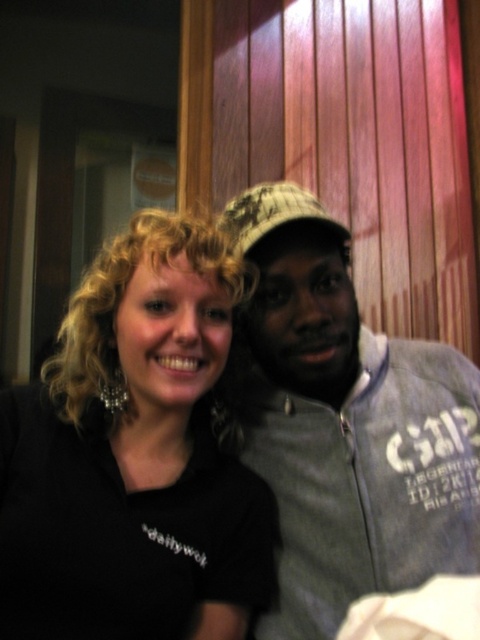
Can you confirm if black matte shirt at center is positioned to the right of gray cotton jacket at right?

Incorrect, black matte shirt at center is not on the right side of gray cotton jacket at right.

Looking at this image, is black matte shirt at center bigger than gray cotton jacket at right?

Incorrect, black matte shirt at center is not larger than gray cotton jacket at right.

Who is more forward, (189,440) or (349,400)?

Point (189,440) is more forward.

Locate an element on the screen. black matte shirt at center is located at coordinates (132, 456).

Can you confirm if black matte shirt at center is positioned to the right of camouflage fabric baseball cap at center?

Incorrect, black matte shirt at center is not on the right side of camouflage fabric baseball cap at center.

Is black matte shirt at center to the left of camouflage fabric baseball cap at center from the viewer's perspective?

Correct, you'll find black matte shirt at center to the left of camouflage fabric baseball cap at center.

The height and width of the screenshot is (640, 480). I want to click on black matte shirt at center, so click(132, 456).

Is point (348, 445) positioned behind point (257, 212)?

Yes, point (348, 445) is farther from viewer.

Looking at this image, can you confirm if gray cotton jacket at right is shorter than camouflage fabric baseball cap at center?

No, gray cotton jacket at right is not shorter than camouflage fabric baseball cap at center.

Is point (337, 592) positioned before point (285, 205)?

Yes, it is.

At what (x,y) coordinates should I click in order to perform the action: click on gray cotton jacket at right. Please return your answer as a coordinate pair (x, y). The image size is (480, 640). Looking at the image, I should click on (346, 422).